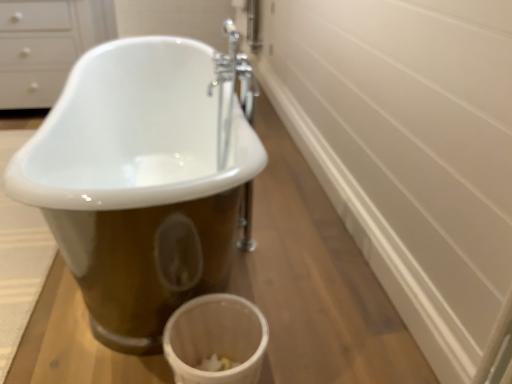
Locate an element on the screen. This screenshot has height=384, width=512. white matte toilet bowl at lower center is located at coordinates (216, 339).

The width and height of the screenshot is (512, 384). What do you see at coordinates (216, 339) in the screenshot?
I see `white matte toilet bowl at lower center` at bounding box center [216, 339].

In order to face white textured bath mat at lower left, should I rotate leftwards or rightwards?

A: A 30.564 degree turn to the left will do.

Identify the location of white glossy drawer at upper left. The height and width of the screenshot is (384, 512). (35, 52).

Find the location of a particular element. white porcelain bathtub at center is located at coordinates (141, 182).

Find the location of `drawer located above the white matte toilet bowl at lower center (from the image's perspective)`. drawer located above the white matte toilet bowl at lower center (from the image's perspective) is located at coordinates (35, 52).

Considering their positions, is white matte toilet bowl at lower center located in front of or behind white glossy drawer at upper left?

white matte toilet bowl at lower center is in front of white glossy drawer at upper left.

Is white matte toilet bowl at lower center oriented towards white glossy drawer at upper left?

No, white matte toilet bowl at lower center is not turned towards white glossy drawer at upper left.

From the image's perspective, is white matte toilet bowl at lower center above or below white glossy drawer at upper left?

white matte toilet bowl at lower center is situated lower than white glossy drawer at upper left in the image.

What's the angular difference between chrome metallic faucet at center and white porcelain bathtub at center's facing directions?

There is a 91.8-degree angle between the facing directions of chrome metallic faucet at center and white porcelain bathtub at center.

Considering the points (229, 55) and (121, 141), which point is behind, point (229, 55) or point (121, 141)?

The point (121, 141) is farther.

From a real-world perspective, between chrome metallic faucet at center and white porcelain bathtub at center, who is vertically lower?

From a 3D spatial view, white porcelain bathtub at center is below.

Is the surface of chrome metallic faucet at center in direct contact with white porcelain bathtub at center?

No, chrome metallic faucet at center is not next to white porcelain bathtub at center.

Considering the sizes of white textured bath mat at lower left and white matte toilet bowl at lower center in the image, is white textured bath mat at lower left taller or shorter than white matte toilet bowl at lower center?

Considering their sizes, white textured bath mat at lower left has less height than white matte toilet bowl at lower center.

Is white textured bath mat at lower left spatially inside white matte toilet bowl at lower center, or outside of it?

white textured bath mat at lower left exists outside the volume of white matte toilet bowl at lower center.

Based on the photo, which of these two, white textured bath mat at lower left or white matte toilet bowl at lower center, is bigger?

Bigger between the two is white textured bath mat at lower left.

Could you tell me if white textured bath mat at lower left is facing white matte toilet bowl at lower center?

No, white textured bath mat at lower left does not turn towards white matte toilet bowl at lower center.

In the image, is white glossy drawer at upper left positioned in front of or behind white porcelain bathtub at center?

white glossy drawer at upper left is behind white porcelain bathtub at center.

From a real-world perspective, who is located higher, white glossy drawer at upper left or white porcelain bathtub at center?

white glossy drawer at upper left is physically above.

Does white glossy drawer at upper left have a lesser height compared to white porcelain bathtub at center?

Incorrect, the height of white glossy drawer at upper left does not fall short of that of white porcelain bathtub at center.

Would you consider white porcelain bathtub at center to be distant from white textured bath mat at lower left?

Actually, white porcelain bathtub at center and white textured bath mat at lower left are a little close together.

How many degrees apart are the facing directions of white porcelain bathtub at center and white textured bath mat at lower left?

The angle between the facing direction of white porcelain bathtub at center and the facing direction of white textured bath mat at lower left is 2.38 degrees.

Based on the photo, is white porcelain bathtub at center closer to the viewer compared to white textured bath mat at lower left?

Yes.

Is white porcelain bathtub at center turned away from white textured bath mat at lower left?

No, white porcelain bathtub at center's orientation is not away from white textured bath mat at lower left.

Does white porcelain bathtub at center turn towards white matte toilet bowl at lower center?

No, white porcelain bathtub at center does not turn towards white matte toilet bowl at lower center.

From the image's perspective, would you say white porcelain bathtub at center is positioned over white matte toilet bowl at lower center?

Yes, from the image's perspective, white porcelain bathtub at center is above white matte toilet bowl at lower center.

Can you tell me how much white porcelain bathtub at center and white matte toilet bowl at lower center differ in facing direction?

They differ by 90.1 degrees in their facing directions.

Relative to white glossy drawer at upper left, is chrome metallic faucet at center in front or behind?

chrome metallic faucet at center is in front of white glossy drawer at upper left.

Is chrome metallic faucet at center not close to white glossy drawer at upper left?

Yes, chrome metallic faucet at center and white glossy drawer at upper left are quite far apart.

Which is behind, point (243, 107) or point (51, 39)?

The point (51, 39) is farther.

From the image's perspective, between chrome metallic faucet at center and white glossy drawer at upper left, which one is located above?

white glossy drawer at upper left is shown above in the image.

This screenshot has width=512, height=384. What are the coordinates of `toilet bowl on the right side of white glossy drawer at upper left` in the screenshot? It's located at (216, 339).

Identify the location of tap below the white porcelain bathtub at center (from the image's perspective). The height and width of the screenshot is (384, 512). (231, 88).

Based on their spatial positions, is white textured bath mat at lower left or chrome metallic faucet at center closer to white glossy drawer at upper left?

Based on the image, white textured bath mat at lower left appears to be nearer to white glossy drawer at upper left.

Which object lies further to the anchor point white porcelain bathtub at center, white glossy drawer at upper left or white matte toilet bowl at lower center?

white glossy drawer at upper left is further to white porcelain bathtub at center.

Looking at this image, based on their spatial positions, is white porcelain bathtub at center or chrome metallic faucet at center further from white textured bath mat at lower left?

chrome metallic faucet at center is further to white textured bath mat at lower left.

Looking at this image, estimate the real-world distances between objects in this image. Which object is further from chrome metallic faucet at center, white matte toilet bowl at lower center or white textured bath mat at lower left?

white textured bath mat at lower left lies further to chrome metallic faucet at center than the other object.

Based on their spatial positions, is chrome metallic faucet at center or white textured bath mat at lower left further from white porcelain bathtub at center?

Among the two, white textured bath mat at lower left is located further to white porcelain bathtub at center.

Looking at the image, which one is located further to chrome metallic faucet at center, white porcelain bathtub at center or white matte toilet bowl at lower center?

white matte toilet bowl at lower center.

Considering their positions, is white textured bath mat at lower left positioned further to white matte toilet bowl at lower center than white porcelain bathtub at center?

white textured bath mat at lower left lies further to white matte toilet bowl at lower center than the other object.

Looking at the image, which one is located closer to white glossy drawer at upper left, white matte toilet bowl at lower center or white porcelain bathtub at center?

white porcelain bathtub at center lies closer to white glossy drawer at upper left than the other object.

Locate an element on the screen. The image size is (512, 384). bathtub located between white textured bath mat at lower left and white matte toilet bowl at lower center in the left-right direction is located at coordinates (141, 182).

This screenshot has height=384, width=512. Identify the location of tap positioned between white porcelain bathtub at center and white glossy drawer at upper left from near to far. (231, 88).

The image size is (512, 384). I want to click on tap between white matte toilet bowl at lower center and white glossy drawer at upper left from front to back, so point(231,88).

This screenshot has height=384, width=512. Identify the location of tap between white textured bath mat at lower left and white glossy drawer at upper left along the z-axis. (231, 88).